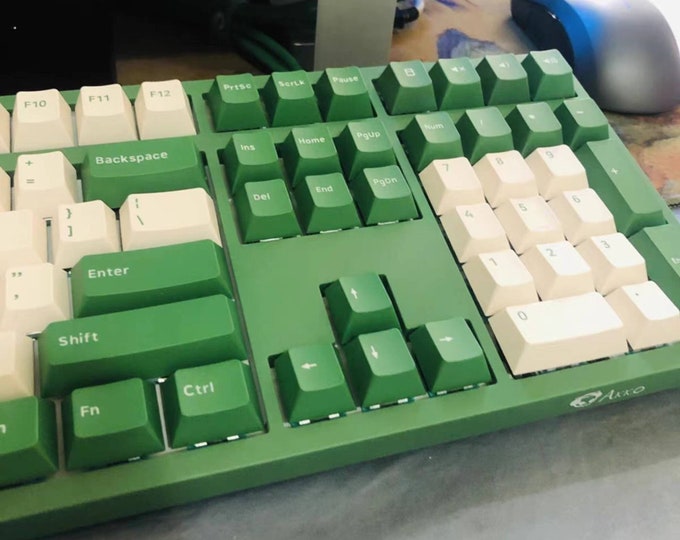
Identify the location of mouse. (x=606, y=30).